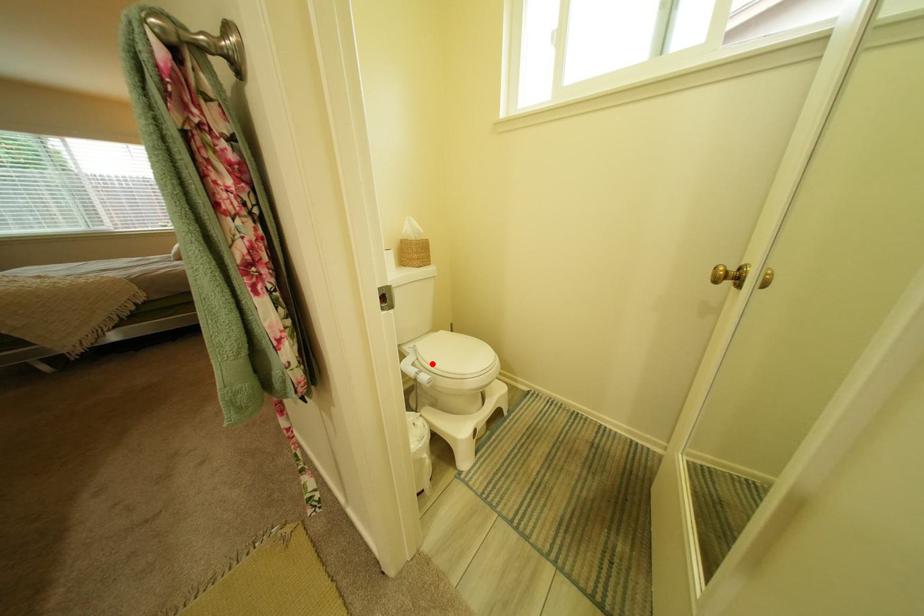
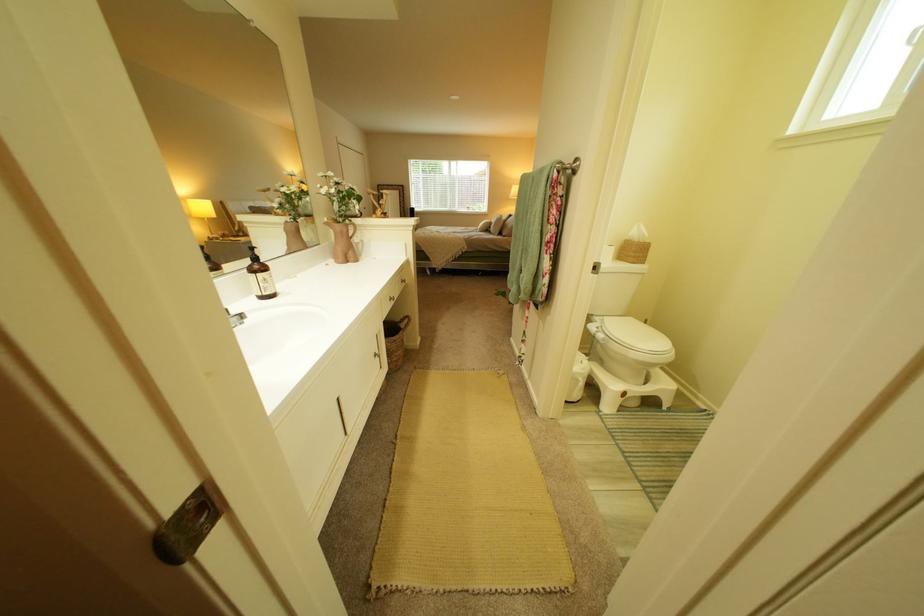
Locate, in the second image, the point that corresponds to the highlighted location in the first image.

(615, 330)